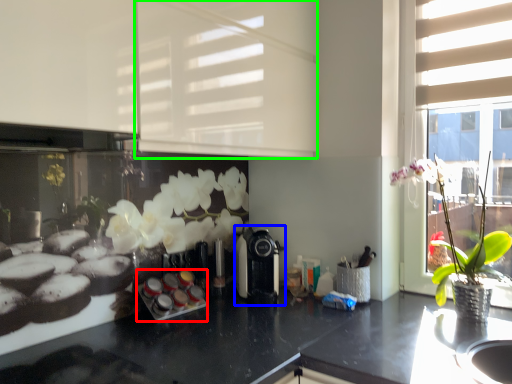
Question: Which is nearer to the appliance (highlighted by a red box)? coffee machine (highlighted by a blue box) or shutter (highlighted by a green box).

Choices:
 (A) coffee machine
 (B) shutter

Answer: (A)